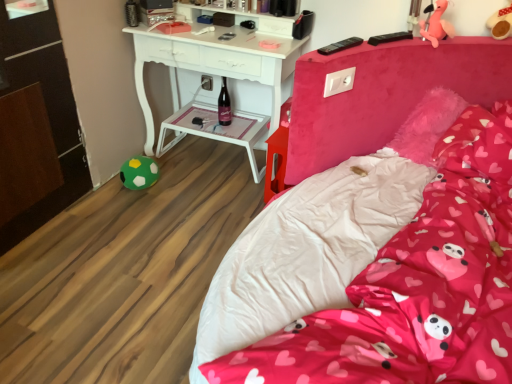
Question: Considering the relative sizes of pink plush toy at upper right, marked as the 3th toy in a bottom-to-top arrangement, and pink fabric pillow at center in the image provided, is pink plush toy at upper right, marked as the 3th toy in a bottom-to-top arrangement, smaller than pink fabric pillow at center?

Choices:
 (A) no
 (B) yes

Answer: (B)

Question: From a real-world perspective, is pink plush toy at upper right, which appears as the second toy when viewed from the front, under pink fabric pillow at center?

Choices:
 (A) no
 (B) yes

Answer: (A)

Question: Is pink plush toy at upper right, which appears as the 1th toy when viewed from the right, outside of pink fabric pillow at center?

Choices:
 (A) yes
 (B) no

Answer: (A)

Question: Is the position of pink plush toy at upper right, marked as the 3th toy in a bottom-to-top arrangement, more distant than that of pink fabric pillow at center?

Choices:
 (A) no
 (B) yes

Answer: (B)

Question: Would you consider pink plush toy at upper right, the 3th toy from the left, to be distant from pink fabric pillow at center?

Choices:
 (A) no
 (B) yes

Answer: (A)

Question: From the image's perspective, is pink plush toy at upper right, the 3th toy from the left, under pink fabric pillow at center?

Choices:
 (A) no
 (B) yes

Answer: (A)

Question: From a real-world perspective, does pink fabric bed at center sit lower than white plastic side table at center?

Choices:
 (A) no
 (B) yes

Answer: (A)

Question: From a real-world perspective, is pink fabric bed at center on white plastic side table at center?

Choices:
 (A) no
 (B) yes

Answer: (B)

Question: Is pink fabric bed at center beside white plastic side table at center?

Choices:
 (A) yes
 (B) no

Answer: (B)

Question: From the image's perspective, is pink fabric bed at center located beneath white plastic side table at center?

Choices:
 (A) no
 (B) yes

Answer: (B)

Question: Is pink fabric bed at center facing away from white plastic side table at center?

Choices:
 (A) no
 (B) yes

Answer: (A)

Question: Does pink fabric bed at center have a lesser width compared to white plastic side table at center?

Choices:
 (A) yes
 (B) no

Answer: (B)

Question: Is pink fabric bed at center to the left of pink plush toy at upper right, the 2th toy positioned from the bottom, from the viewer's perspective?

Choices:
 (A) yes
 (B) no

Answer: (A)